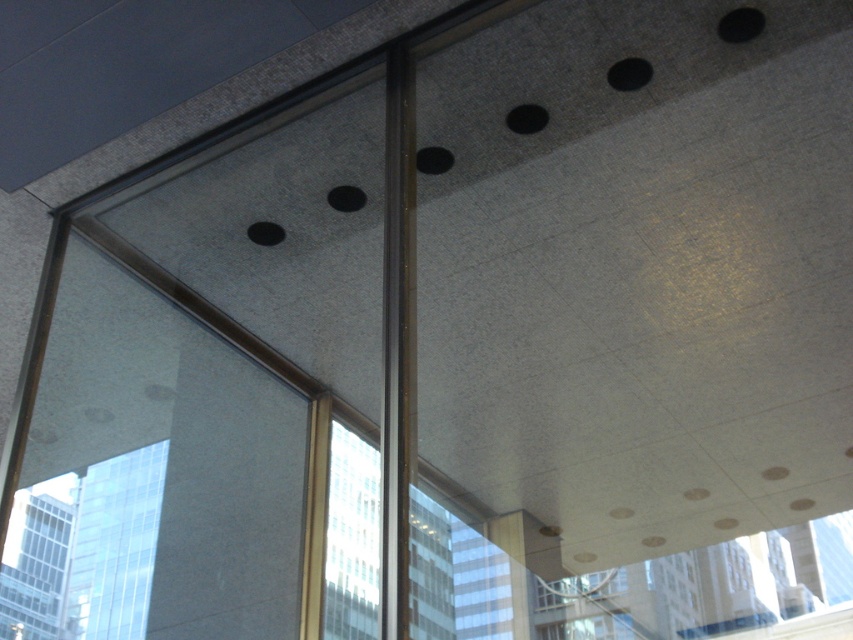
Question: From the image, what is the correct spatial relationship of transparent glass window at lower right in relation to transparent glass window at lower left?

Choices:
 (A) below
 (B) above

Answer: (B)

Question: Which point is farther from the camera taking this photo?

Choices:
 (A) (834, 520)
 (B) (108, 557)

Answer: (B)

Question: Which of the following is the farthest from the observer?

Choices:
 (A) (91, 522)
 (B) (608, 595)

Answer: (A)

Question: From the image, what is the correct spatial relationship of transparent glass window at lower right in relation to transparent glass window at lower left?

Choices:
 (A) left
 (B) right

Answer: (B)

Question: Is transparent glass window at lower right further to the viewer compared to transparent glass window at lower left?

Choices:
 (A) yes
 (B) no

Answer: (B)